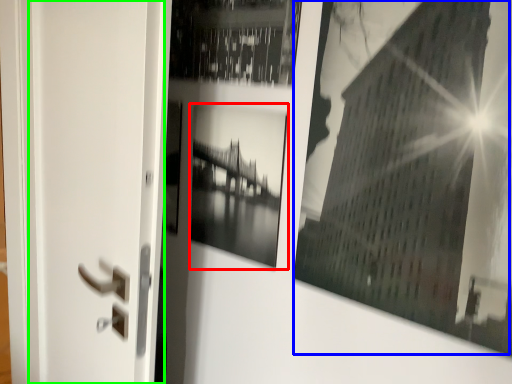
Question: Which object is positioned farthest from picture frame (highlighted by a red box)? Select from picture frame (highlighted by a blue box) and screen door (highlighted by a green box).

Choices:
 (A) picture frame
 (B) screen door

Answer: (B)